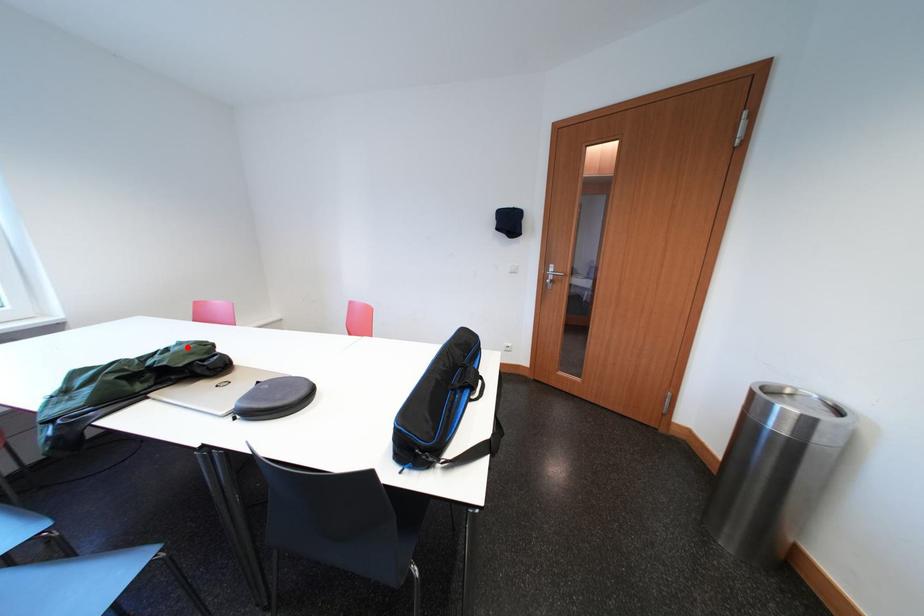
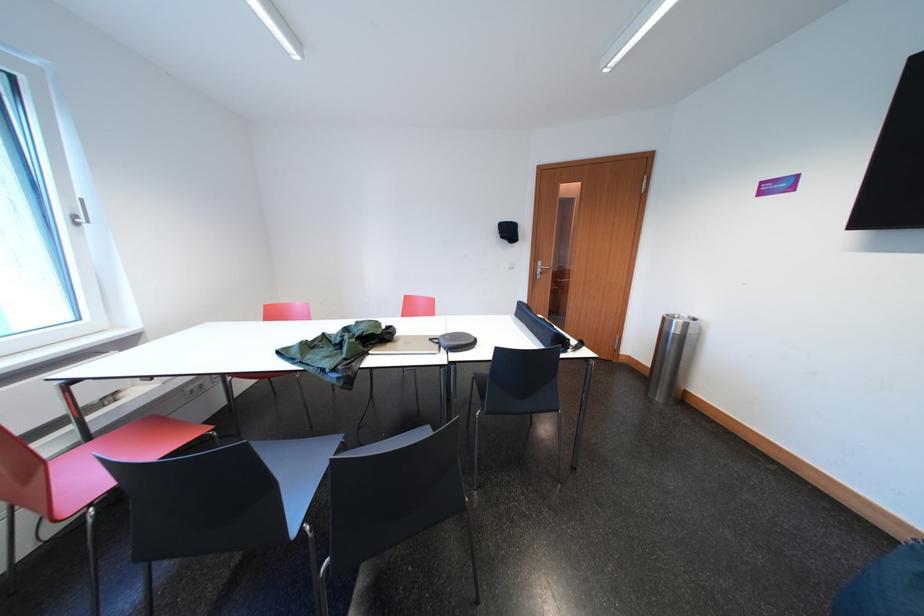
Locate, in the second image, the point that corresponds to the highlighted location in the first image.

(367, 326)